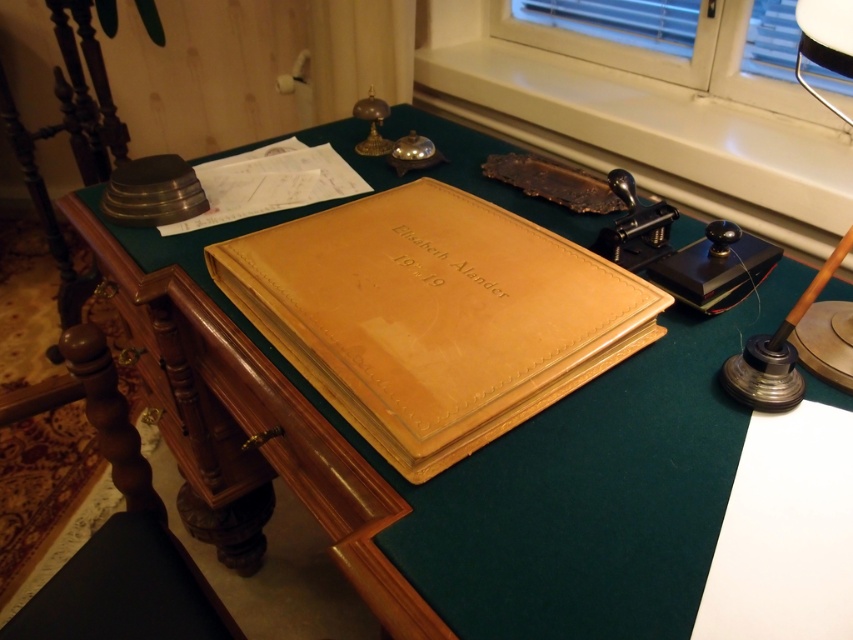
Does matte leather book at center have a smaller size compared to white plastic window at upper right?

Yes, matte leather book at center is smaller than white plastic window at upper right.

Consider the image. Between matte leather book at center and white plastic window at upper right, which one appears on the right side from the viewer's perspective?

white plastic window at upper right is more to the right.

Does point (512, 406) lie in front of point (737, 44)?

Yes.

Where is `matte leather book at center`? matte leather book at center is located at coordinates (434, 316).

Is brown wood chair at lower left further to the viewer compared to wooden table lamp at right?

Yes, brown wood chair at lower left is further from the viewer.

Can you confirm if brown wood chair at lower left is wider than wooden table lamp at right?

Correct, the width of brown wood chair at lower left exceeds that of wooden table lamp at right.

Which is behind, point (115, 403) or point (727, 369)?

Positioned behind is point (115, 403).

The width and height of the screenshot is (853, 640). What are the coordinates of `brown wood chair at lower left` in the screenshot? It's located at (120, 540).

In the scene shown: Is matte leather book at center to the right of brown wood chair at lower left from the viewer's perspective?

Yes, matte leather book at center is to the right of brown wood chair at lower left.

Is the position of matte leather book at center more distant than that of brown wood chair at lower left?

No, it is in front of brown wood chair at lower left.

Which is in front, point (524, 362) or point (76, 618)?

Point (524, 362) is more forward.

The height and width of the screenshot is (640, 853). Identify the location of matte leather book at center. (434, 316).